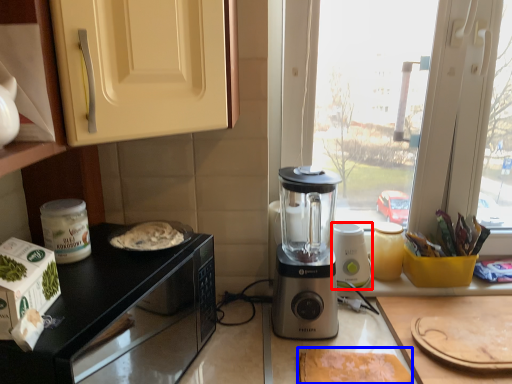
Question: Which object appears closest to the camera in this image, blender (highlighted by a red box) or food (highlighted by a blue box)?

Choices:
 (A) blender
 (B) food

Answer: (B)